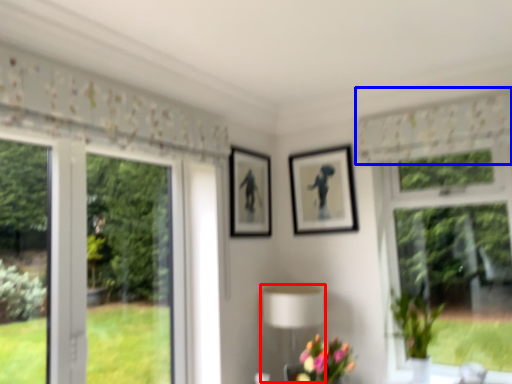
Question: Which point is closer to the camera, table lamp (highlighted by a red box) or curtain (highlighted by a blue box)?

Choices:
 (A) table lamp
 (B) curtain

Answer: (B)